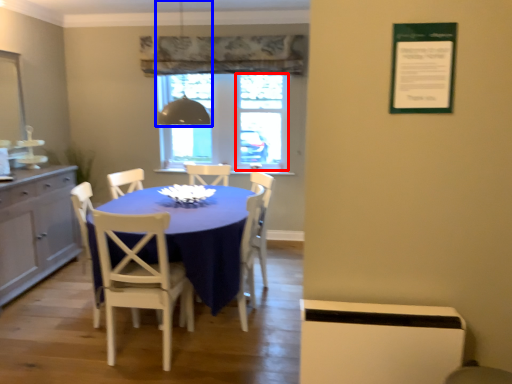
Question: Which point is further to the camera, window screen (highlighted by a red box) or light fixture (highlighted by a blue box)?

Choices:
 (A) window screen
 (B) light fixture

Answer: (A)